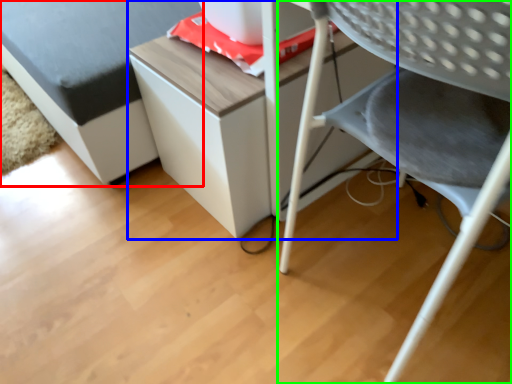
Question: Estimate the real-world distances between objects in this image. Which object is farther from furniture (highlighted by a red box), table (highlighted by a blue box) or chair (highlighted by a green box)?

Choices:
 (A) table
 (B) chair

Answer: (B)